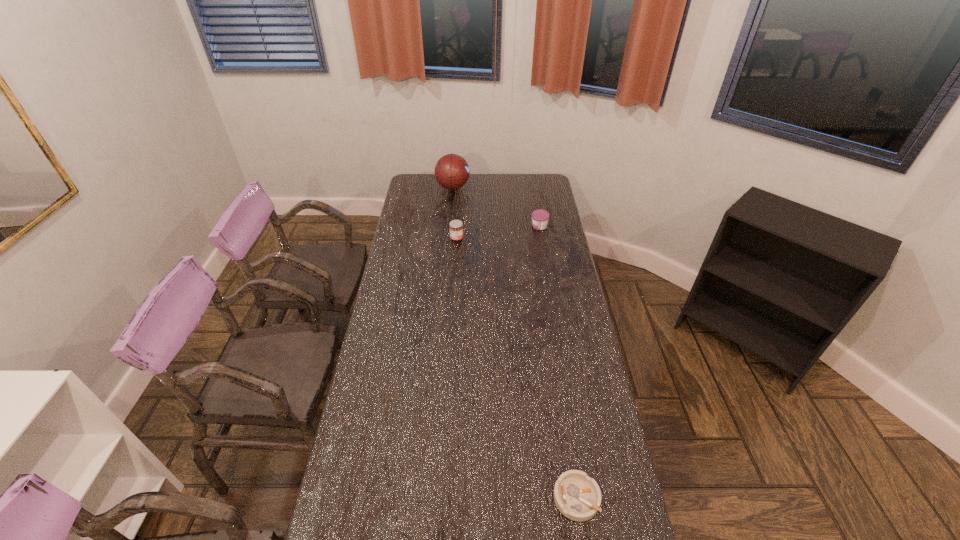
Identify the location of object that stands as the second closest to the tallest object. (540, 217).

You are a GUI agent. You are given a task and a screenshot of the screen. Output one action in this format:
    pyautogui.click(x=<x>, y=<y>)
    Task: Click on the free space that satisfies the following two spatial constraints: 1. on the front side of the tallest object; 2. on the left side of the ashtray
    The image size is (960, 540).
    Given the screenshot: What is the action you would take?
    pyautogui.click(x=425, y=498)